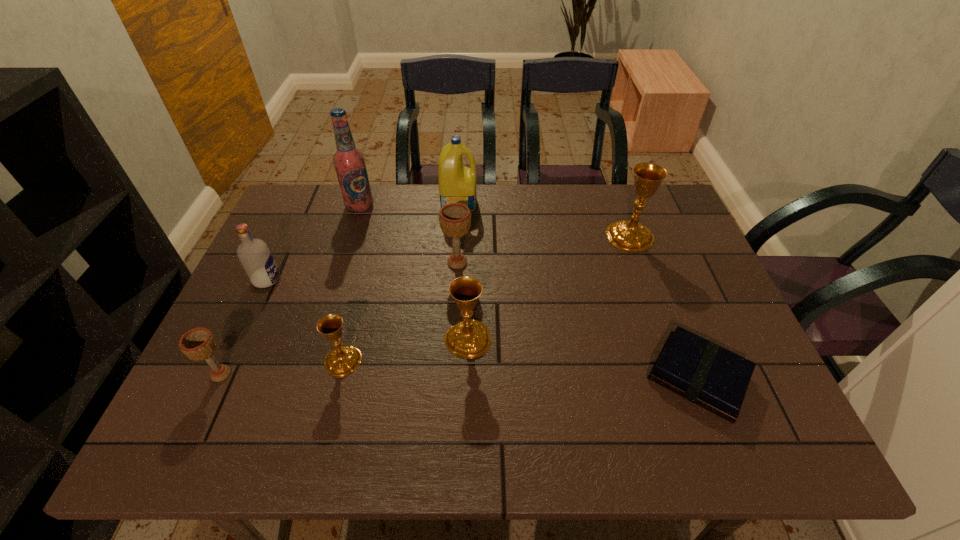
I want to click on the left beige chalice, so click(x=198, y=344).

This screenshot has width=960, height=540. Find the location of `the second chalice from left to right`. the second chalice from left to right is located at coordinates (343, 360).

Where is `the smallest gold chalice`? the smallest gold chalice is located at coordinates (343, 360).

Locate an element on the screen. This screenshot has width=960, height=540. book is located at coordinates (701, 371).

This screenshot has width=960, height=540. Find the location of `blue book`. blue book is located at coordinates (701, 371).

The width and height of the screenshot is (960, 540). Identify the location of free space located 0.050m on the back of the alcohol. (365, 189).

Find the location of a particular element. This screenshot has height=540, width=960. vacant space located on the label of the detergent is located at coordinates (581, 202).

Image resolution: width=960 pixels, height=540 pixels. In order to click on free spot located on the back of the rightmost gold chalice in this screenshot , I will do `click(613, 190)`.

Find the location of a particular element. vacant region located on the label of the vodka is located at coordinates (372, 280).

Find the location of a particular element. This screenshot has width=960, height=540. free space located on the right of the second gold chalice from left to right is located at coordinates (538, 339).